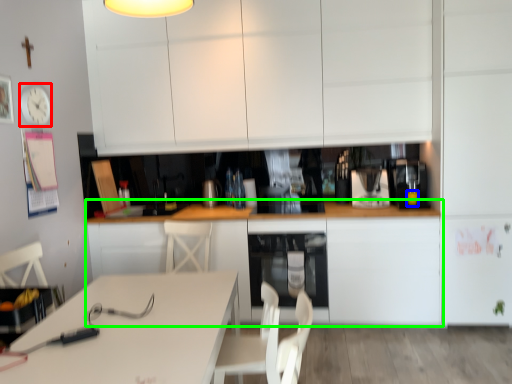
Question: Considering the real-world distances, which object is closest to clock (highlighted by a red box)? beverage (highlighted by a blue box) or cabinetry (highlighted by a green box).

Choices:
 (A) beverage
 (B) cabinetry

Answer: (B)